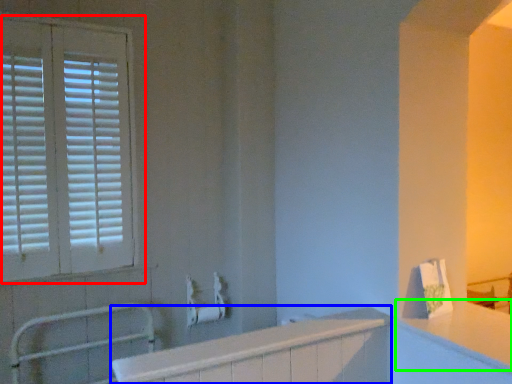
Question: Estimate the real-world distances between objects in this image. Which object is closer to window (highlighted by a red box), bath (highlighted by a blue box) or counter top (highlighted by a green box)?

Choices:
 (A) bath
 (B) counter top

Answer: (A)